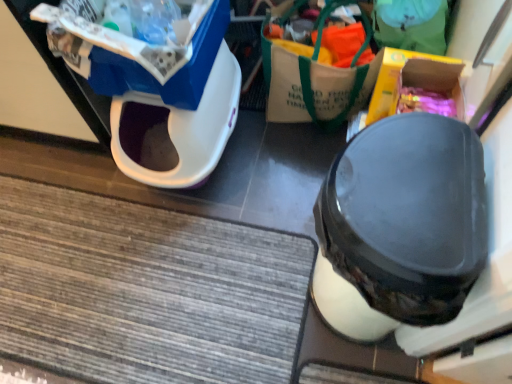
Question: From the image's perspective, is white plastic litter bin at upper left positioned above or below black matte shoe at center?

Choices:
 (A) above
 (B) below

Answer: (A)

Question: In terms of height, does white plastic litter bin at upper left look taller or shorter compared to black matte shoe at center?

Choices:
 (A) short
 (B) tall

Answer: (A)

Question: Considering the real-world distances, which object is farthest from the black matte shoe at center?

Choices:
 (A) blue plastic storage box at upper left, the second storage box from the right
 (B) yellow cardboard box at upper right, the 2th storage box when ordered from left to right
 (C) white canvas tote bag at upper center
 (D) white plastic litter bin at upper left

Answer: (D)

Question: Which object is the farthest from the black matte shoe at center?

Choices:
 (A) white canvas tote bag at upper center
 (B) blue plastic storage box at upper left, placed as the 1th storage box when sorted from left to right
 (C) yellow cardboard box at upper right, which is counted as the 1th storage box, starting from the right
 (D) white plastic litter bin at upper left

Answer: (D)